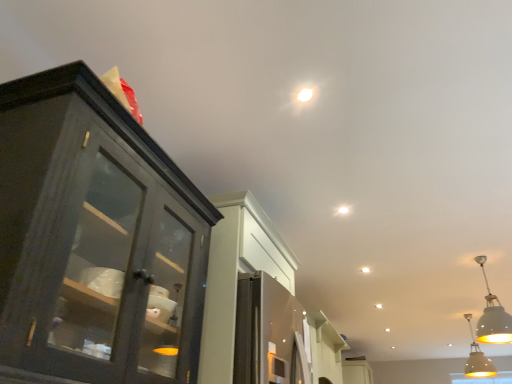
Question: Considering the relative positions of white matte pendant light at lower right, which appears as the 2th light fixture when viewed from the back, and white matte droplight at upper center in the image provided, is white matte pendant light at lower right, which appears as the 2th light fixture when viewed from the back, to the right of white matte droplight at upper center from the viewer's perspective?

Choices:
 (A) no
 (B) yes

Answer: (B)

Question: Can you confirm if white matte pendant light at lower right, which appears as the 2th light fixture when viewed from the back, is positioned to the left of white matte droplight at upper center?

Choices:
 (A) yes
 (B) no

Answer: (B)

Question: Is white matte pendant light at lower right, which is the 1th light fixture from top to bottom, smaller than white matte droplight at upper center?

Choices:
 (A) no
 (B) yes

Answer: (A)

Question: From the image's perspective, is white matte pendant light at lower right, marked as the second light fixture in a bottom-to-top arrangement, beneath white matte droplight at upper center?

Choices:
 (A) no
 (B) yes

Answer: (B)

Question: From a real-world perspective, is white matte pendant light at lower right, marked as the second light fixture in a bottom-to-top arrangement, on top of white matte droplight at upper center?

Choices:
 (A) no
 (B) yes

Answer: (A)

Question: In terms of width, does white matte droplight at upper center look wider or thinner when compared to matte yellow pendant light at lower right, marked as the first light fixture in a back-to-front arrangement?

Choices:
 (A) thin
 (B) wide

Answer: (A)

Question: From the image's perspective, relative to matte yellow pendant light at lower right, which is counted as the first light fixture, starting from the right, is white matte droplight at upper center above or below?

Choices:
 (A) above
 (B) below

Answer: (A)

Question: Is point (305, 89) closer or farther from the camera than point (475, 344)?

Choices:
 (A) farther
 (B) closer

Answer: (B)

Question: Is white matte droplight at upper center taller or shorter than matte yellow pendant light at lower right, the first light fixture when ordered from bottom to top?

Choices:
 (A) short
 (B) tall

Answer: (A)

Question: In the image, is white matte cabinet at center positioned in front of or behind white matte droplight at upper center?

Choices:
 (A) front
 (B) behind

Answer: (B)

Question: Is white matte cabinet at center situated inside white matte droplight at upper center or outside?

Choices:
 (A) outside
 (B) inside

Answer: (A)

Question: Is white matte cabinet at center to the left or to the right of white matte droplight at upper center in the image?

Choices:
 (A) left
 (B) right

Answer: (B)

Question: Is white matte cabinet at center wider or thinner than white matte droplight at upper center?

Choices:
 (A) thin
 (B) wide

Answer: (B)

Question: Looking at the image, does white matte pendant light at lower right, positioned as the first light fixture in front-to-back order, seem bigger or smaller compared to matte yellow pendant light at lower right, positioned as the 2th light fixture in front-to-back order?

Choices:
 (A) big
 (B) small

Answer: (A)

Question: Does point (508, 319) appear closer or farther from the camera than point (475, 339)?

Choices:
 (A) closer
 (B) farther

Answer: (A)